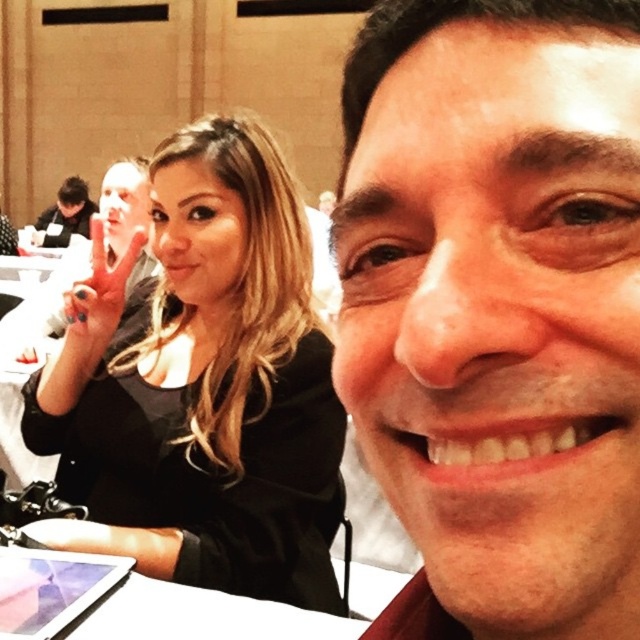
You are a photographer trying to capture a clear shot of the smooth skin face at center and the black matte hair at upper left. Which object is closer to the camera?

The smooth skin face at center is closer to the camera than the black matte hair at upper left because it is in front of it.

Based on the scene description, what object is located at the coordinates point (497, 307)?

The smooth skin face at center is located at point (497, 307).

You are a photographer trying to capture a group photo. You notice the smooth skin face at center and the black matte hair at upper left in your viewfinder. Based on their positions, which object should you adjust your camera to focus on first to ensure both are in frame?

The smooth skin face at center is above the black matte hair at upper left, so you should focus on the black matte hair at upper left first to ensure both are in frame.